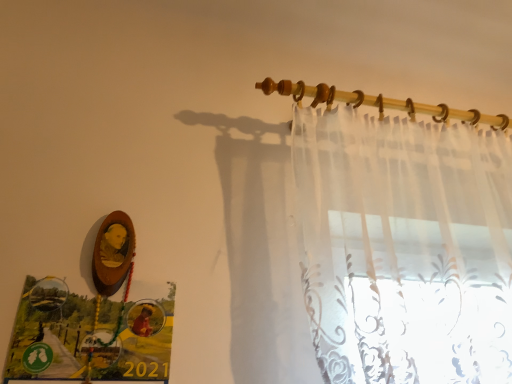
The height and width of the screenshot is (384, 512). Describe the element at coordinates (379, 103) in the screenshot. I see `translucent fabric at upper center` at that location.

The height and width of the screenshot is (384, 512). I want to click on translucent fabric at upper center, so click(379, 103).

Image resolution: width=512 pixels, height=384 pixels. In order to click on sheer white curtain at upper right in this screenshot , I will do `click(405, 248)`.

What do you see at coordinates (405, 248) in the screenshot? This screenshot has height=384, width=512. I see `sheer white curtain at upper right` at bounding box center [405, 248].

At what (x,y) coordinates should I click in order to perform the action: click on translucent fabric at upper center. Please return your answer as a coordinate pair (x, y). Looking at the image, I should click on (379, 103).

Does sheer white curtain at upper right appear on the right side of translucent fabric at upper center?

Yes.

From the picture: Is sheer white curtain at upper right in front of translucent fabric at upper center?

Yes, it is.

Between point (444, 330) and point (271, 93), which one is positioned in front?

The point (444, 330) is more forward.

From the image's perspective, which is below, sheer white curtain at upper right or translucent fabric at upper center?

sheer white curtain at upper right appears lower in the image.

From a real-world perspective, is sheer white curtain at upper right physically above translucent fabric at upper center?

No, from a real-world perspective, sheer white curtain at upper right is not above translucent fabric at upper center.

Which of these two, sheer white curtain at upper right or translucent fabric at upper center, is wider?

Wider between the two is sheer white curtain at upper right.

Considering the sizes of objects sheer white curtain at upper right and translucent fabric at upper center in the image provided, who is shorter, sheer white curtain at upper right or translucent fabric at upper center?

Standing shorter between the two is translucent fabric at upper center.

Who is bigger, sheer white curtain at upper right or translucent fabric at upper center?

With larger size is sheer white curtain at upper right.

Is sheer white curtain at upper right positioned beyond the bounds of translucent fabric at upper center?

Yes.

Consider the image. Is sheer white curtain at upper right not close to translucent fabric at upper center?

No, sheer white curtain at upper right is in close proximity to translucent fabric at upper center.

Is sheer white curtain at upper right looking in the opposite direction of translucent fabric at upper center?

No, sheer white curtain at upper right's orientation is not away from translucent fabric at upper center.

What's the angular difference between sheer white curtain at upper right and translucent fabric at upper center's facing directions?

The angle between the facing direction of sheer white curtain at upper right and the facing direction of translucent fabric at upper center is 0.00713 degrees.

Where is `curtain that appears in front of the translucent fabric at upper center`? curtain that appears in front of the translucent fabric at upper center is located at coordinates (405, 248).

Is translucent fabric at upper center to the left or to the right of sheer white curtain at upper right in the image?

From the image, it's evident that translucent fabric at upper center is to the left of sheer white curtain at upper right.

Does translucent fabric at upper center lie in front of sheer white curtain at upper right?

No, translucent fabric at upper center is further to the viewer.

Considering the positions of point (280, 92) and point (327, 299), is point (280, 92) closer or farther from the camera than point (327, 299)?

Clearly, point (280, 92) is more distant from the camera than point (327, 299).

From the image's perspective, which object appears higher, translucent fabric at upper center or sheer white curtain at upper right?

translucent fabric at upper center is shown above in the image.

From a real-world perspective, who is located higher, translucent fabric at upper center or sheer white curtain at upper right?

translucent fabric at upper center is physically above.

Considering the relative sizes of translucent fabric at upper center and sheer white curtain at upper right in the image provided, is translucent fabric at upper center wider than sheer white curtain at upper right?

Incorrect, the width of translucent fabric at upper center does not surpass that of sheer white curtain at upper right.

Which of these two, translucent fabric at upper center or sheer white curtain at upper right, stands taller?

Standing taller between the two is sheer white curtain at upper right.

Is translucent fabric at upper center bigger than sheer white curtain at upper right?

No.

Is translucent fabric at upper center situated inside sheer white curtain at upper right or outside?

translucent fabric at upper center is located beyond the bounds of sheer white curtain at upper right.

Is the surface of translucent fabric at upper center in direct contact with sheer white curtain at upper right?

There is a gap between translucent fabric at upper center and sheer white curtain at upper right.

Is translucent fabric at upper center looking in the opposite direction of sheer white curtain at upper right?

No, translucent fabric at upper center's orientation is not away from sheer white curtain at upper right.

Can you tell me how much translucent fabric at upper center and sheer white curtain at upper right differ in facing direction?

They differ by 0.00713 degrees in their facing directions.

The width and height of the screenshot is (512, 384). Find the location of `curtain in front of the translucent fabric at upper center`. curtain in front of the translucent fabric at upper center is located at coordinates (405, 248).

In order to click on clothesline to the left of sheer white curtain at upper right in this screenshot , I will do `click(379, 103)`.

Identify the location of curtain in front of the translucent fabric at upper center. The width and height of the screenshot is (512, 384). (405, 248).